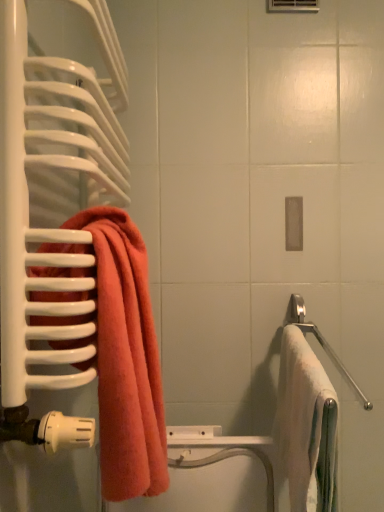
Question: Is satin silver towel bar at right not within coral terry towel at left, arranged as the first towel when viewed from the left?

Choices:
 (A) yes
 (B) no

Answer: (A)

Question: Is satin silver towel bar at right beside coral terry towel at left, arranged as the first towel when viewed from the left?

Choices:
 (A) no
 (B) yes

Answer: (A)

Question: Is satin silver towel bar at right oriented towards coral terry towel at left, the 2th towel in the right-to-left sequence?

Choices:
 (A) no
 (B) yes

Answer: (A)

Question: From the image's perspective, would you say satin silver towel bar at right is shown under coral terry towel at left, arranged as the first towel when viewed from the left?

Choices:
 (A) yes
 (B) no

Answer: (A)

Question: Can you confirm if satin silver towel bar at right is smaller than coral terry towel at left, arranged as the first towel when viewed from the left?

Choices:
 (A) yes
 (B) no

Answer: (A)

Question: Is satin silver towel bar at right to the right of coral terry towel at left, arranged as the first towel when viewed from the left, from the viewer's perspective?

Choices:
 (A) yes
 (B) no

Answer: (A)

Question: Considering the relative sizes of coral terry towel at left, arranged as the first towel when viewed from the left, and satin silver towel bar at right in the image provided, is coral terry towel at left, arranged as the first towel when viewed from the left, shorter than satin silver towel bar at right?

Choices:
 (A) no
 (B) yes

Answer: (A)

Question: Would you say coral terry towel at left, arranged as the first towel when viewed from the left, is outside satin silver towel bar at right?

Choices:
 (A) no
 (B) yes

Answer: (B)

Question: Is coral terry towel at left, the 2th towel in the right-to-left sequence, far away from satin silver towel bar at right?

Choices:
 (A) yes
 (B) no

Answer: (B)

Question: Does coral terry towel at left, arranged as the first towel when viewed from the left, have a greater width compared to satin silver towel bar at right?

Choices:
 (A) yes
 (B) no

Answer: (A)

Question: Is satin silver towel bar at right at the back of coral terry towel at left, the 2th towel in the right-to-left sequence?

Choices:
 (A) no
 (B) yes

Answer: (A)

Question: Is coral terry towel at left, arranged as the first towel when viewed from the left, with satin silver towel bar at right?

Choices:
 (A) no
 (B) yes

Answer: (A)

Question: Can we say white soft towel at right, the first towel from the right, lies outside coral terry towel at left, the 2th towel in the right-to-left sequence?

Choices:
 (A) yes
 (B) no

Answer: (A)